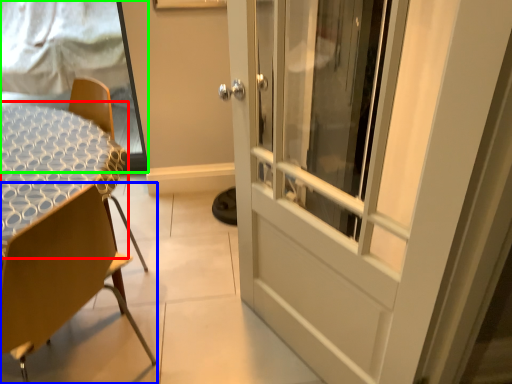
Question: Estimate the real-world distances between objects in this image. Which object is farther from round table (highlighted by a red box), chair (highlighted by a blue box) or window screen (highlighted by a green box)?

Choices:
 (A) chair
 (B) window screen

Answer: (B)